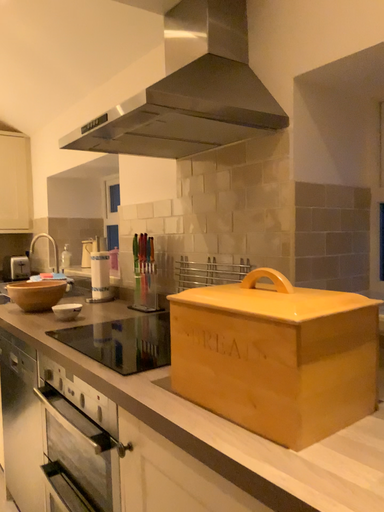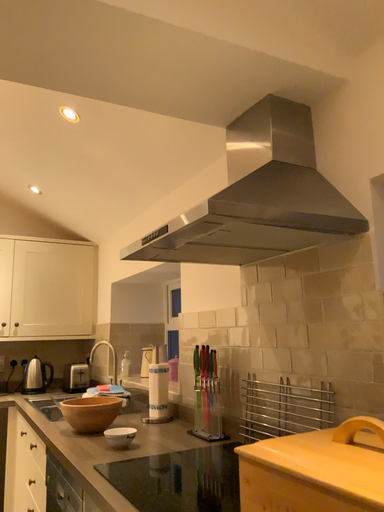
Question: How did the camera likely rotate when shooting the video?

Choices:
 (A) rotated right
 (B) rotated left

Answer: (B)